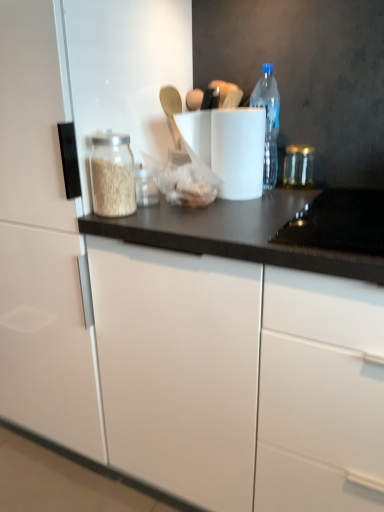
Question: Is white glossy cabinet at left beside transparent glass jar at right?

Choices:
 (A) yes
 (B) no

Answer: (B)

Question: Can you confirm if white glossy cabinet at left is bigger than transparent glass jar at right?

Choices:
 (A) yes
 (B) no

Answer: (A)

Question: Does white glossy cabinet at left appear on the left side of transparent glass jar at right?

Choices:
 (A) yes
 (B) no

Answer: (A)

Question: Can you confirm if white glossy cabinet at left is taller than transparent glass jar at right?

Choices:
 (A) no
 (B) yes

Answer: (B)

Question: Does white glossy cabinet at left lie behind transparent glass jar at right?

Choices:
 (A) no
 (B) yes

Answer: (A)

Question: From a real-world perspective, is white glossy cabinet at left positioned over transparent glass jar at right based on gravity?

Choices:
 (A) no
 (B) yes

Answer: (A)

Question: From the image's perspective, does white matte paper towel at center appear higher than white glossy cabinet at left?

Choices:
 (A) yes
 (B) no

Answer: (A)

Question: Is white matte paper towel at center to the right of white glossy cabinet at left from the viewer's perspective?

Choices:
 (A) yes
 (B) no

Answer: (A)

Question: Is white matte paper towel at center further to camera compared to white glossy cabinet at left?

Choices:
 (A) yes
 (B) no

Answer: (A)

Question: Is white matte paper towel at center facing away from white glossy cabinet at left?

Choices:
 (A) no
 (B) yes

Answer: (A)

Question: Is white matte paper towel at center at the left side of white glossy cabinet at left?

Choices:
 (A) yes
 (B) no

Answer: (B)

Question: Would you say white matte paper towel at center is outside white glossy cabinet at left?

Choices:
 (A) no
 (B) yes

Answer: (B)

Question: Does white glossy cabinet at left have a lesser width compared to white matte paper towel at center?

Choices:
 (A) no
 (B) yes

Answer: (A)